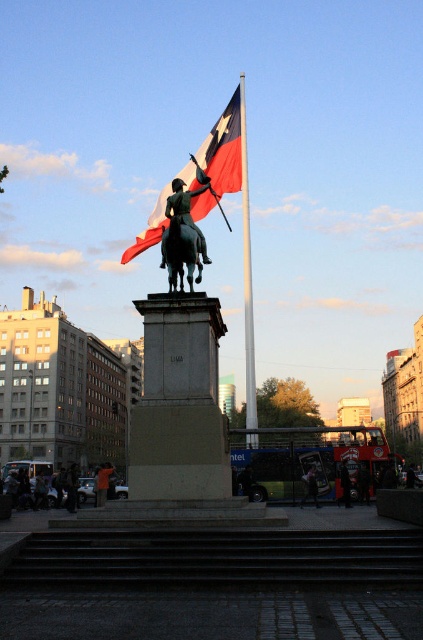
Question: Considering the relative positions of red fabric flag at upper center and polished bronze statue at center in the image provided, where is red fabric flag at upper center located with respect to polished bronze statue at center?

Choices:
 (A) below
 (B) above

Answer: (B)

Question: Among these points, which one is farthest from the camera?

Choices:
 (A) [315, 483]
 (B) [181, 195]

Answer: (A)

Question: Which of the following is the closest to the observer?

Choices:
 (A) polished bronze statue at center
 (B) red fabric flag at upper center
 (C) dark brown leather jacket at lower center
 (D) orange cloth at center

Answer: (A)

Question: Which of these objects is positioned closest to the dark blue jeans at lower center?

Choices:
 (A) polished bronze statue at center
 (B) red fabric flag at upper center

Answer: (A)

Question: Is silver metallic flag pole at center below shiny black horse at center?

Choices:
 (A) no
 (B) yes

Answer: (A)

Question: Is red fabric flag at upper center smaller than dark blue jeans at lower center?

Choices:
 (A) no
 (B) yes

Answer: (A)